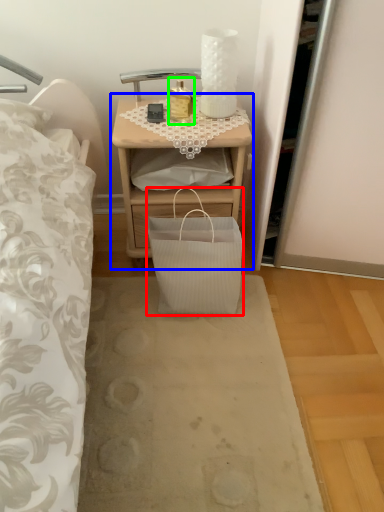
Question: Estimate the real-world distances between objects in this image. Which object is farther from bag (highlighted by a red box), nightstand (highlighted by a blue box) or bottle (highlighted by a green box)?

Choices:
 (A) nightstand
 (B) bottle

Answer: (B)